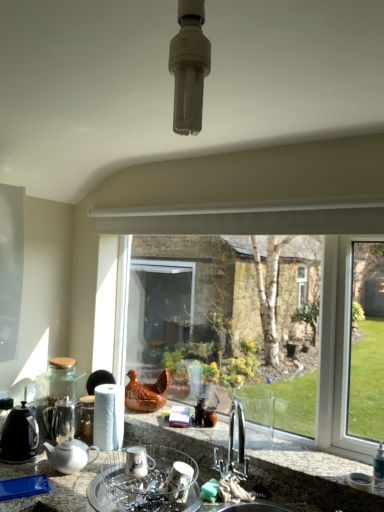
I want to click on granite countertop at lower center, so click(x=311, y=478).

What is the approximate height of granite countertop at lower center?

granite countertop at lower center is 63.07 centimeters in height.

I want to click on clear glass window at center, so click(x=322, y=280).

Locate an element on the screen. white glossy teapot at lower left, which is the 1th kitchen appliance from right to left is located at coordinates tap(70, 455).

Find the location of `white ceramic mug at lower center, which ranks as the 2th appliance in front-to-back order`. white ceramic mug at lower center, which ranks as the 2th appliance in front-to-back order is located at coordinates (138, 462).

Find the location of a particular element. Image resolution: width=384 pixels, height=512 pixels. black matte kettle at left, which is the 1th kitchen appliance from left to right is located at coordinates (21, 436).

Locate an element on the screen. shiny metallic teapot at left is located at coordinates (62, 419).

Is the position of shiny metallic teapot at left more distant than that of granite countertop at lower center?

Yes, shiny metallic teapot at left is further from the viewer.

From a real-world perspective, is shiny metallic teapot at left on granite countertop at lower center?

Yes.

Who is taller, shiny metallic teapot at left or granite countertop at lower center?

granite countertop at lower center.

Considering the sizes of shiny metallic teapot at left and granite countertop at lower center in the image, is shiny metallic teapot at left bigger or smaller than granite countertop at lower center?

shiny metallic teapot at left is smaller than granite countertop at lower center.

Looking at their sizes, would you say granite countertop at lower center is wider or thinner than shiny metallic teapot at left?

In the image, granite countertop at lower center appears to be wider than shiny metallic teapot at left.

How far apart are granite countertop at lower center and shiny metallic teapot at left?

granite countertop at lower center and shiny metallic teapot at left are 22.71 inches apart.

Are granite countertop at lower center and shiny metallic teapot at left far apart?

No, granite countertop at lower center is not far from shiny metallic teapot at left.

From a real-world perspective, who is located higher, granite countertop at lower center or shiny metallic teapot at left?

shiny metallic teapot at left is physically above.

Between metallic sink at lower center and porcelain dish rack at center, arranged as the first appliance when viewed from the front, which one appears on the left side from the viewer's perspective?

porcelain dish rack at center, arranged as the first appliance when viewed from the front.

Can you tell me how much metallic sink at lower center and porcelain dish rack at center, the 2th appliance viewed from the back, differ in facing direction?

0.000115 degrees separate the facing orientations of metallic sink at lower center and porcelain dish rack at center, the 2th appliance viewed from the back.

Between metallic sink at lower center and porcelain dish rack at center, the 2th appliance viewed from the back, which one has more height?

Standing taller between the two is metallic sink at lower center.

Is metallic sink at lower center oriented away from porcelain dish rack at center, the 2th appliance viewed from the back?

No, metallic sink at lower center's orientation is not away from porcelain dish rack at center, the 2th appliance viewed from the back.

Does point (16, 410) appear closer or farther from the camera than point (46, 425)?

Point (16, 410) is closer to the camera than point (46, 425).

Which object is wider, black matte kettle at left, which is the 1th kitchen appliance from left to right, or shiny metallic teapot at left?

black matte kettle at left, which is the 1th kitchen appliance from left to right.

Which kitchen appliance is the 1st one when counting from the front of the shiny metallic teapot at left? Please provide its 2D coordinates.

[(21, 436)]

From a real-world perspective, which is physically below, black matte kettle at left, positioned as the 2th kitchen appliance in right-to-left order, or shiny metallic teapot at left?

shiny metallic teapot at left is physically lower.

Would you say granite countertop at lower center is part of metallic sink at lower center's contents?

Definitely not — granite countertop at lower center is not inside metallic sink at lower center.

From the picture: Considering their positions, is metallic sink at lower center located in front of or behind granite countertop at lower center?

Clearly, metallic sink at lower center is behind granite countertop at lower center.

From the image's perspective, is metallic sink at lower center positioned above or below granite countertop at lower center?

Based on their image positions, metallic sink at lower center is located above granite countertop at lower center.

What's the angular difference between white ceramic mug at lower center, the first appliance when ordered from back to front, and black matte kettle at left, positioned as the 2th kitchen appliance in right-to-left order,'s facing directions?

There is a 0.00146-degree angle between the facing directions of white ceramic mug at lower center, the first appliance when ordered from back to front, and black matte kettle at left, positioned as the 2th kitchen appliance in right-to-left order.

Does point (145, 451) lie behind point (19, 455)?

No, (145, 451) is closer to viewer.

Is white ceramic mug at lower center, the first appliance when ordered from back to front, touching black matte kettle at left, positioned as the 2th kitchen appliance in right-to-left order?

white ceramic mug at lower center, the first appliance when ordered from back to front, and black matte kettle at left, positioned as the 2th kitchen appliance in right-to-left order, are clearly separated.

This screenshot has width=384, height=512. There is a white ceramic mug at lower center, the first appliance when ordered from back to front. What are the coordinates of `the 2nd kitchen appliance above it (from a real-world perspective)` in the screenshot? It's located at (21, 436).

Would you say clear glass window at center contains metallic sink at lower center?

Actually, metallic sink at lower center is outside clear glass window at center.

Which of these two, clear glass window at center or metallic sink at lower center, is smaller?

With smaller size is metallic sink at lower center.

Is clear glass window at center shorter than metallic sink at lower center?

No.

Locate an element on the screen. The height and width of the screenshot is (512, 384). countertop located underneath the shiny metallic teapot at left (from a real-world perspective) is located at coordinates (311, 478).

The image size is (384, 512). I want to click on countertop in front of the shiny metallic teapot at left, so click(311, 478).

Which object lies further to the anchor point black matte kettle at left, positioned as the 2th kitchen appliance in right-to-left order, white glossy teapot at lower left, which is the 1th kitchen appliance from right to left, or granite countertop at lower center?

The object further to black matte kettle at left, positioned as the 2th kitchen appliance in right-to-left order, is granite countertop at lower center.

Estimate the real-world distances between objects in this image. Which object is closer to white glossy teapot at lower left, which is the 1th kitchen appliance from right to left, porcelain dish rack at center, the 2th appliance viewed from the back, or granite countertop at lower center?

Based on the image, porcelain dish rack at center, the 2th appliance viewed from the back, appears to be nearer to white glossy teapot at lower left, which is the 1th kitchen appliance from right to left.

When comparing their distances from porcelain dish rack at center, the 2th appliance viewed from the back, does white ceramic mug at lower center, which ranks as the 2th appliance in front-to-back order, or white glossy teapot at lower left, the second kitchen appliance positioned from the left, seem further?

Among the two, white glossy teapot at lower left, the second kitchen appliance positioned from the left, is located further to porcelain dish rack at center, the 2th appliance viewed from the back.

When comparing their distances from shiny metallic teapot at left, does porcelain dish rack at center, the 2th appliance viewed from the back, or white ceramic mug at lower center, the first appliance when ordered from back to front, seem closer?

white ceramic mug at lower center, the first appliance when ordered from back to front.

Looking at the image, which one is located closer to white ceramic mug at lower center, which ranks as the 2th appliance in front-to-back order, metallic sink at lower center or black matte kettle at left, positioned as the 2th kitchen appliance in right-to-left order?

metallic sink at lower center is closer to white ceramic mug at lower center, which ranks as the 2th appliance in front-to-back order.

Looking at the image, which one is located closer to white ceramic mug at lower center, which ranks as the 2th appliance in front-to-back order, black matte kettle at left, which is the 1th kitchen appliance from left to right, or metallic sink at lower center?

metallic sink at lower center is closer to white ceramic mug at lower center, which ranks as the 2th appliance in front-to-back order.

When comparing their distances from metallic sink at lower center, does porcelain dish rack at center, the 2th appliance viewed from the back, or black matte kettle at left, which is the 1th kitchen appliance from left to right, seem further?

The object further to metallic sink at lower center is black matte kettle at left, which is the 1th kitchen appliance from left to right.

From the image, which object appears to be nearer to black matte kettle at left, positioned as the 2th kitchen appliance in right-to-left order, metallic sink at lower center or porcelain dish rack at center, arranged as the first appliance when viewed from the front?

porcelain dish rack at center, arranged as the first appliance when viewed from the front, lies closer to black matte kettle at left, positioned as the 2th kitchen appliance in right-to-left order, than the other object.

Where is `sink positioned between granite countertop at lower center and shiny metallic teapot at left from near to far`? This screenshot has width=384, height=512. sink positioned between granite countertop at lower center and shiny metallic teapot at left from near to far is located at coordinates (239, 472).

Identify the location of kitchen appliance between black matte kettle at left, which is the 1th kitchen appliance from left to right, and white ceramic mug at lower center, the first appliance when ordered from back to front, from left to right. (70, 455).

At what (x,y) coordinates should I click in order to perform the action: click on sink between granite countertop at lower center and white ceramic mug at lower center, the first appliance when ordered from back to front, from front to back. Please return your answer as a coordinate pair (x, y). The image size is (384, 512). Looking at the image, I should click on (239, 472).

You are a GUI agent. You are given a task and a screenshot of the screen. Output one action in this format:
    pyautogui.click(x=<x>, y=<y>)
    Task: Click on the appliance between clear glass window at center and porcelain dish rack at center, the 2th appliance viewed from the back, vertically
    The width and height of the screenshot is (384, 512).
    Given the screenshot: What is the action you would take?
    pyautogui.click(x=138, y=462)